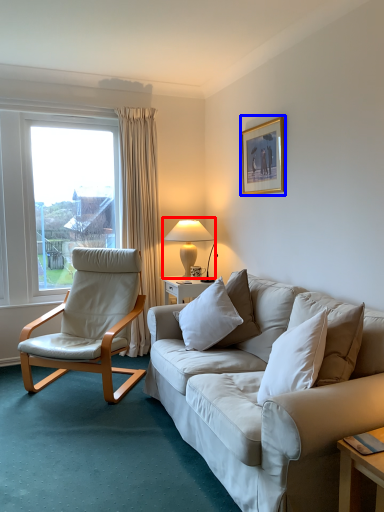
Question: Which object appears closest to the camera in this image, table lamp (highlighted by a red box) or picture frame (highlighted by a blue box)?

Choices:
 (A) table lamp
 (B) picture frame

Answer: (B)